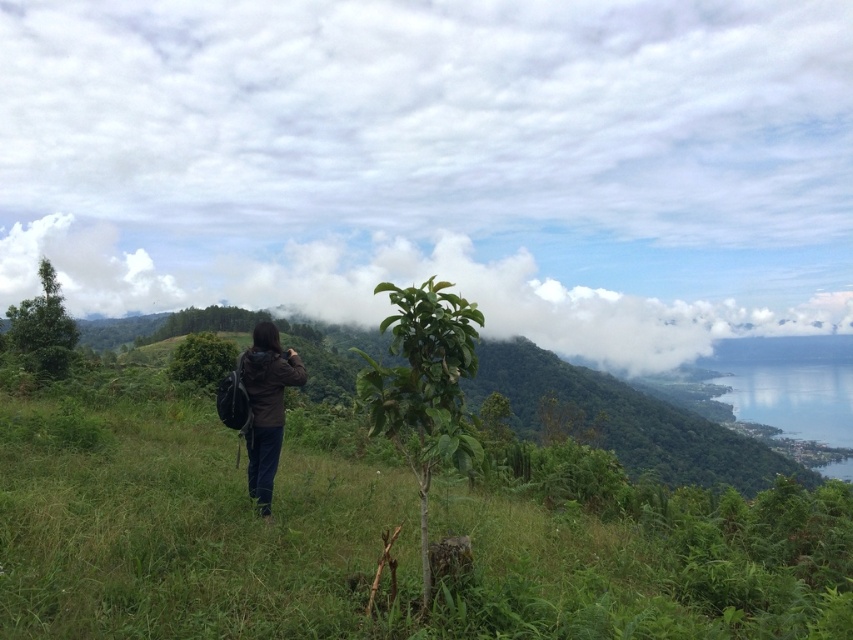
You are a photographer trying to capture the entire scene in one shot. The green leafy tree at left and the green leafy bush at center are both in your frame. Which object is wider?

The green leafy tree at left is wider than the green leafy bush at center.

You are standing in the scene and want to take a photo of the green leafy tree at center. If your camera can focus on objects up to 4 meters away, will it be able to capture the tree clearly?

The green leafy tree at center is 3.81 meters away from the viewer, which is within the camera focus range of up to 4 meters. Therefore, the camera can capture the tree clearly.